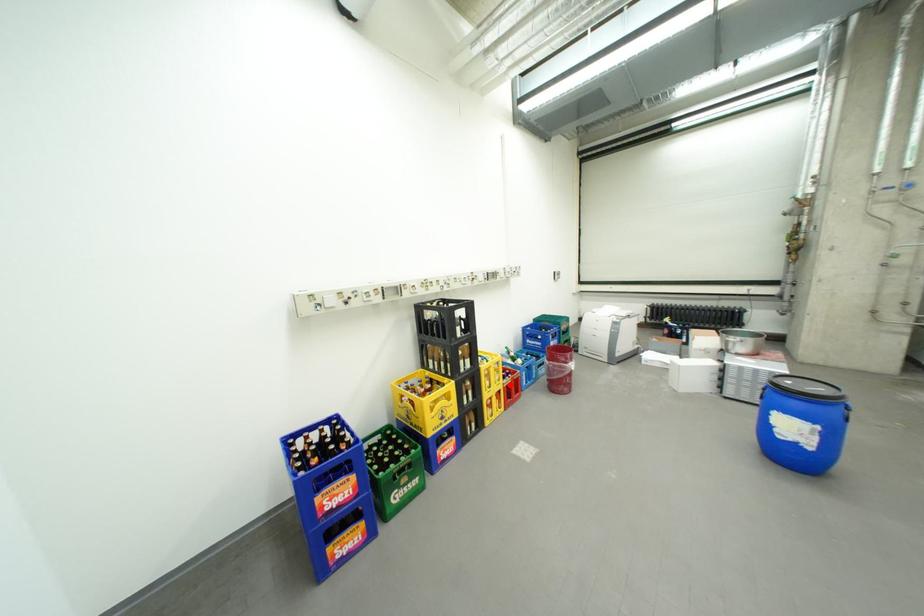
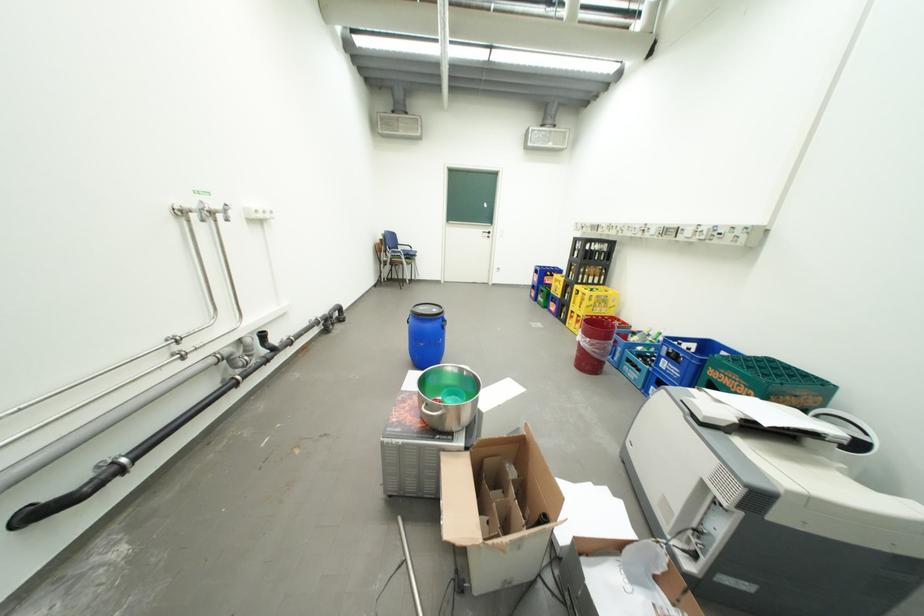
Where in the second image is the point corresponding to the highlighted location from the first image?

(590, 312)